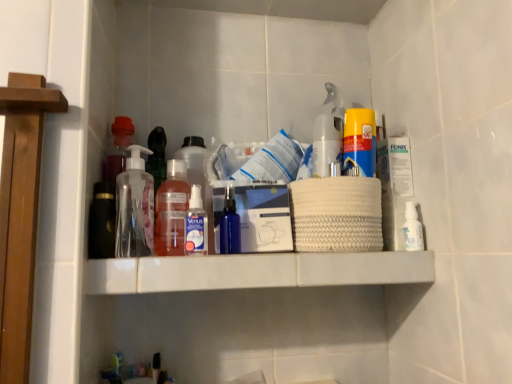
Identify the location of free space between clear plastic spray bottle at right, acting as the 1th bottle starting from the right, and clear plastic spray bottle at center, positioned as the 3th bottle in right-to-left order. (302, 254).